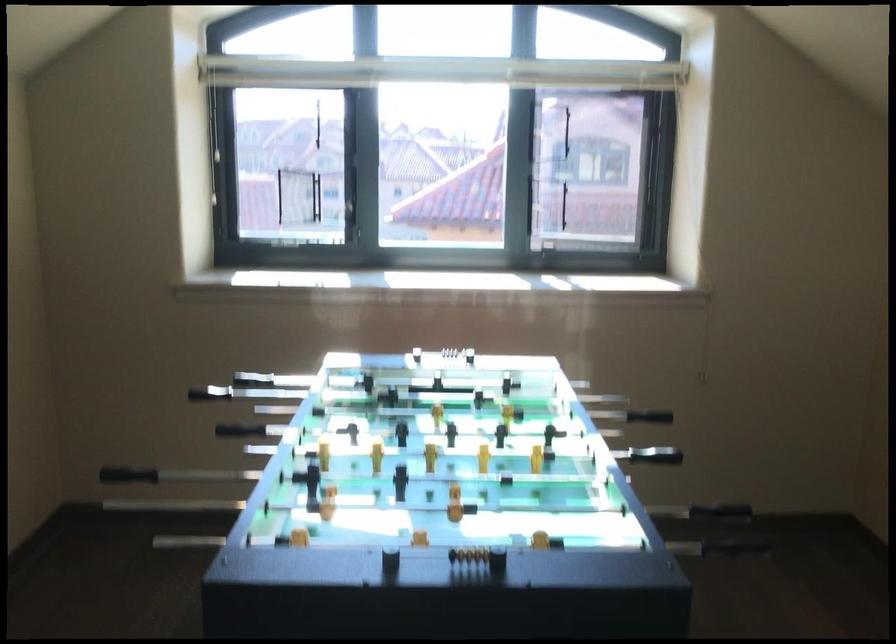
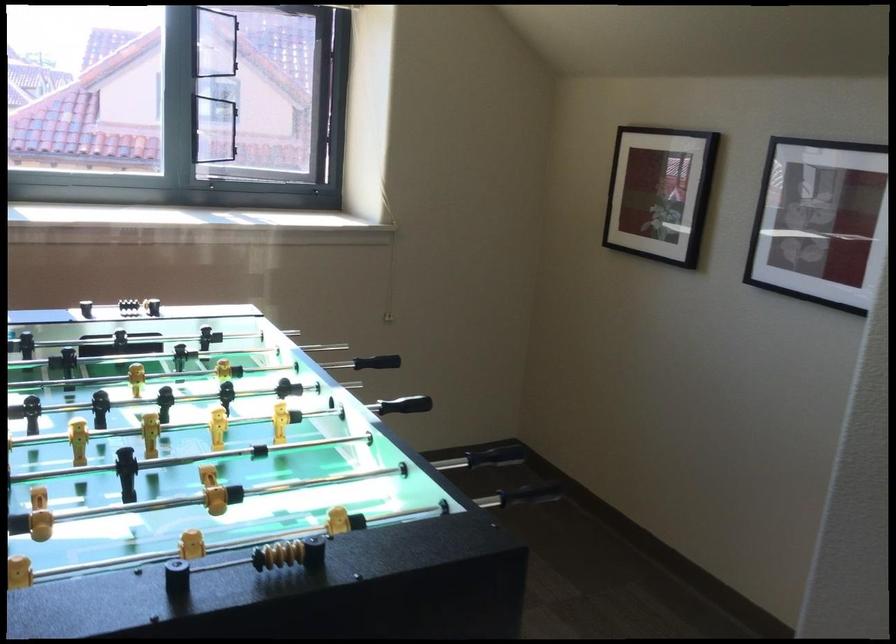
Question: The camera is either moving clockwise (left) or counter-clockwise (right) around the object. The first image is from the beginning of the video and the second image is from the end. Is the camera moving left or right when shooting the video?

Choices:
 (A) Left
 (B) Right

Answer: (A)